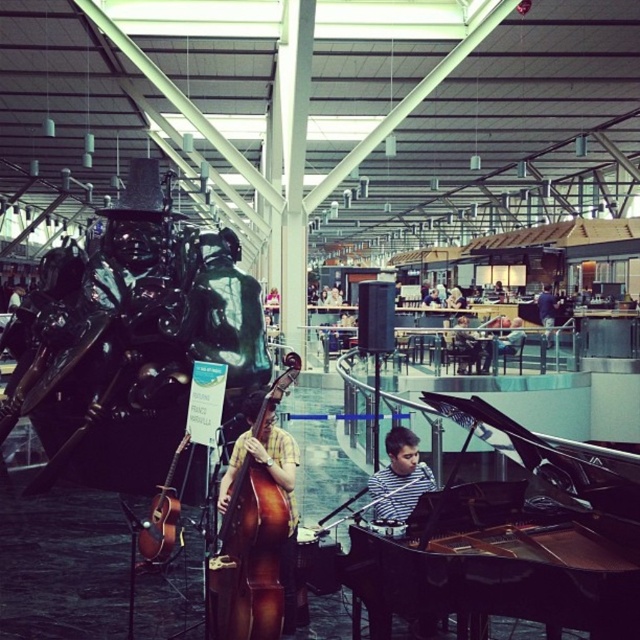
You are a photographer setting up a camera in the center of the stage. You notice the striped fabric at center and the dark blue shirt at center. Which object should you adjust your focus on if you want to capture the wider object?

The dark blue shirt at center is wider than the striped fabric at center, so you should focus on the dark blue shirt at center to capture the wider object.